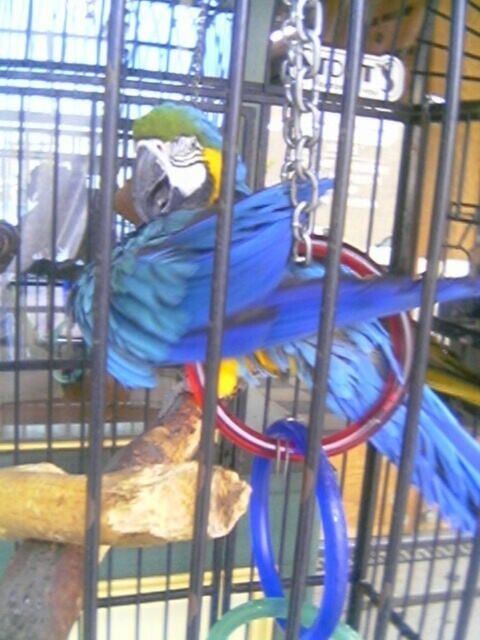
Can you confirm if blue glossy parrot at center is positioned below metallic silver chain at upper right?

Correct, blue glossy parrot at center is located below metallic silver chain at upper right.

Can you confirm if blue glossy parrot at center is smaller than metallic silver chain at upper right?

Actually, blue glossy parrot at center might be larger than metallic silver chain at upper right.

Which is in front, point (308, 288) or point (297, 90)?

Point (308, 288) is more forward.

Where is `blue glossy parrot at center`? blue glossy parrot at center is located at coordinates (165, 246).